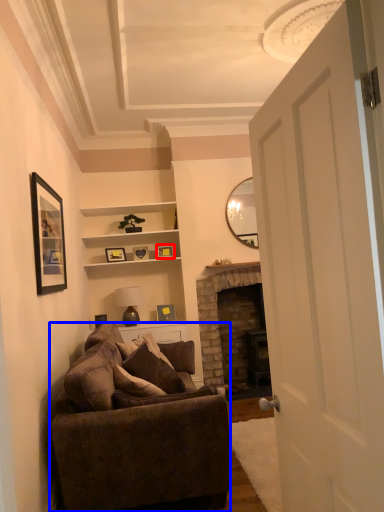
Question: Among these objects, which one is nearest to the camera, picture frame (highlighted by a red box) or studio couch (highlighted by a blue box)?

Choices:
 (A) picture frame
 (B) studio couch

Answer: (B)